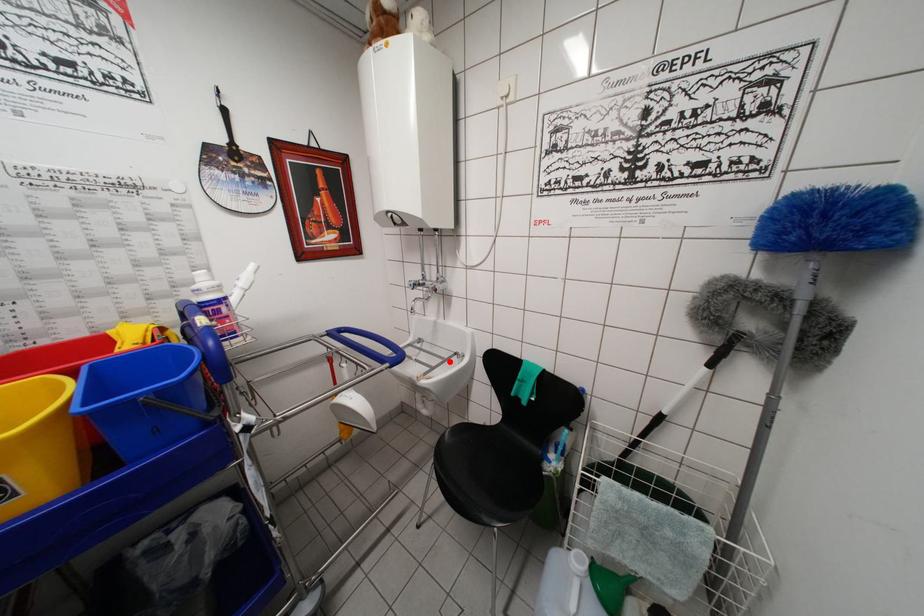
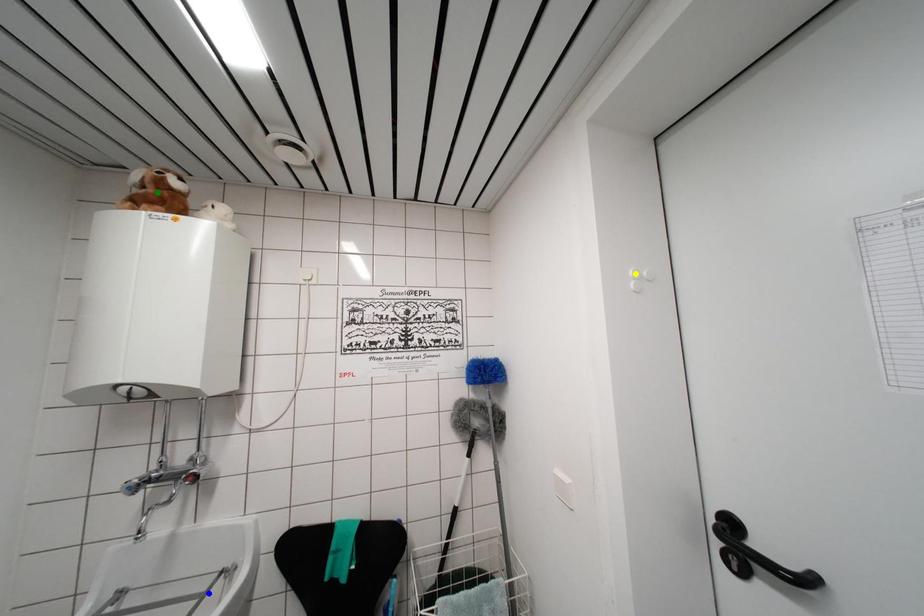
Question: I am providing you with two images of the same scene from different viewpoints. A red point is marked on the first image. You are given multiple points on the second image. Which mark in image 2 goes with the point in image 1?

Choices:
 (A) blue point
 (B) green point
 (C) yellow point

Answer: (A)